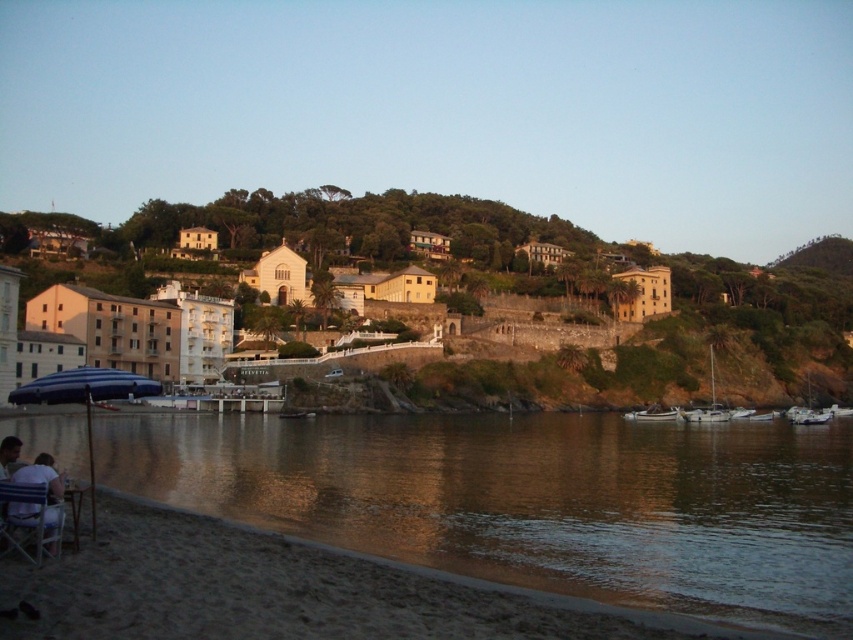
Question: Which of the following is the closest to the observer?

Choices:
 (A) white plastic boat at lower right
 (B) metallic silver beach chair at lower left
 (C) brown reflective water at lower left

Answer: (C)

Question: Is brown reflective water at lower left to the left of white plastic boat at lower right from the viewer's perspective?

Choices:
 (A) yes
 (B) no

Answer: (A)

Question: Which point is farther from the camera taking this photo?

Choices:
 (A) (712, 378)
 (B) (94, 506)
 (C) (648, 408)
 (D) (22, 502)

Answer: (A)

Question: Among these objects, which one is farthest from the camera?

Choices:
 (A) white plastic boat at lower right
 (B) white glossy sailboat at lower right
 (C) blue matte umbrella at lower left
 (D) white matte boat at lower right

Answer: (A)

Question: Can you confirm if brown reflective water at lower left is smaller than white glossy sailboat at lower right?

Choices:
 (A) no
 (B) yes

Answer: (A)

Question: Is brown reflective water at lower left below white plastic boat at lower right?

Choices:
 (A) yes
 (B) no

Answer: (A)